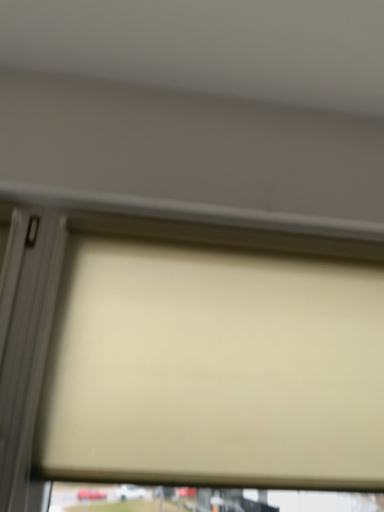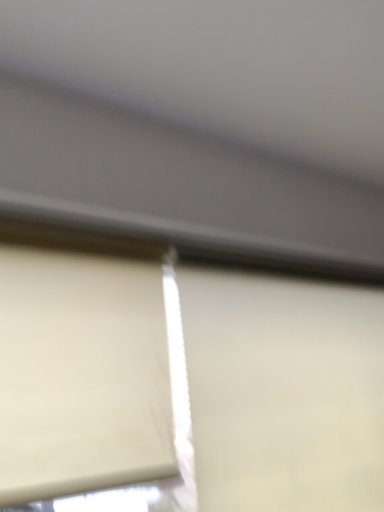
Question: How did the camera likely rotate when shooting the video?

Choices:
 (A) rotated left
 (B) rotated right

Answer: (B)